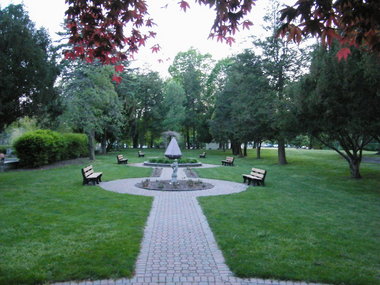
You are a GUI agent. You are given a task and a screenshot of the screen. Output one action in this format:
    pyautogui.click(x=<x>, y=<y>)
    Task: Click on the statue
    
    Given the screenshot: What is the action you would take?
    pyautogui.click(x=174, y=172)